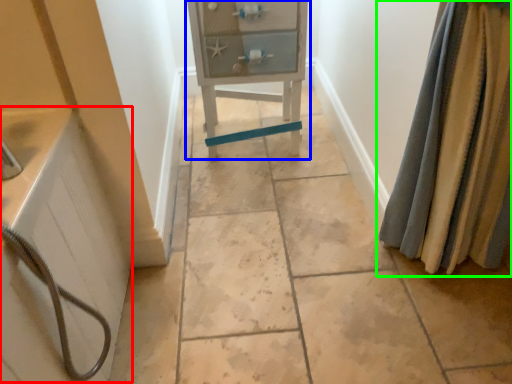
Question: Based on their relative distances, which object is farther from bath (highlighted by a red box)? Choose from furniture (highlighted by a blue box) and curtain (highlighted by a green box).

Choices:
 (A) furniture
 (B) curtain

Answer: (B)